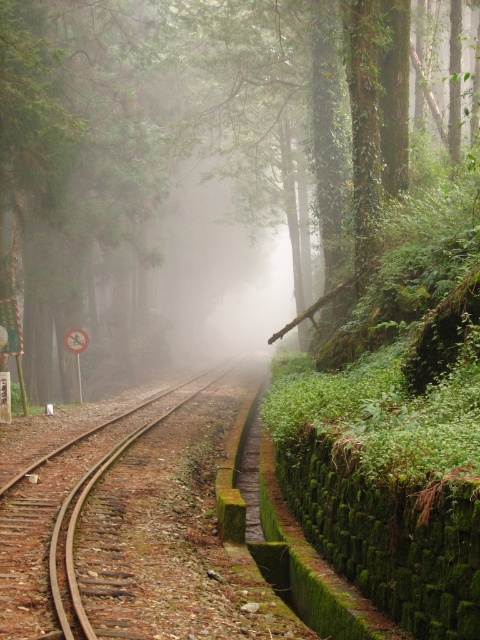
You are a hiker who wants to cross the railway tracks. You see the green leafy tree at center and the rusty metal train track at center. Which object is bigger and can you use the tree to cross the tracks safely?

The green leafy tree at center is larger in size than the rusty metal train track at center. However, the tree is a natural object and may not provide a stable structure for crossing the tracks safely. It is advisable to use designated crossings or pathways for safety.

Looking at this image, you are a hiker standing at the origin point of the railway tracks. You want to reach the green leafy tree at center. According to the coordinates provided, in which direction should you walk to reach it?

The green leafy tree at center is located at coordinates point (155, 145). Since the origin is at the starting point of the railway tracks, you should walk towards the direction of the coordinates to reach it.

You are a hiker standing at the edge of the forest looking at the scene. You notice the green leafy tree at center and the rusty metal train track at center. Which object is closer to you?

The green leafy tree at center is closer to you because the rusty metal train track at center is behind it.